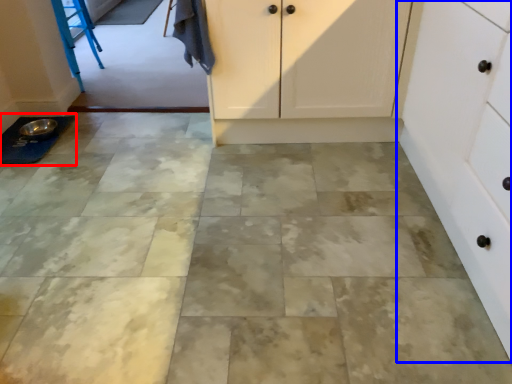
Question: Which object is closer to the camera taking this photo, sink (highlighted by a red box) or cabinetry (highlighted by a blue box)?

Choices:
 (A) sink
 (B) cabinetry

Answer: (B)